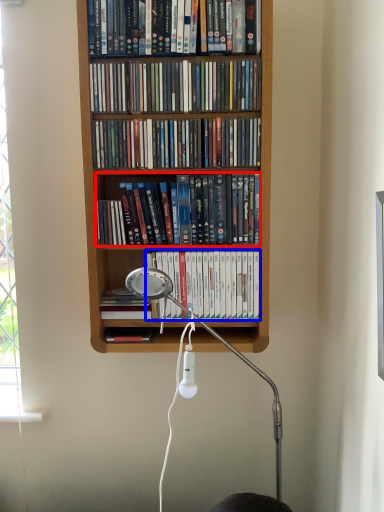
Question: Which point is further to the camera, book (highlighted by a red box) or book (highlighted by a blue box)?

Choices:
 (A) book
 (B) book

Answer: (B)